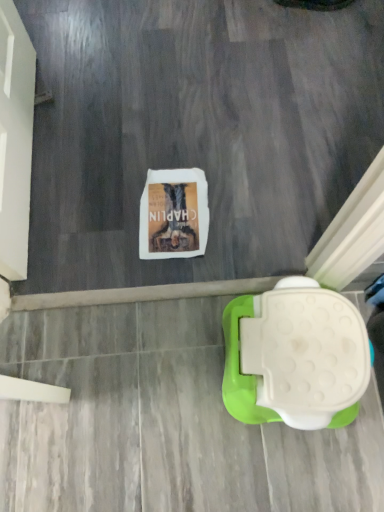
In order to click on free space in front of white plastic toilet at lower right in this screenshot , I will do `click(273, 456)`.